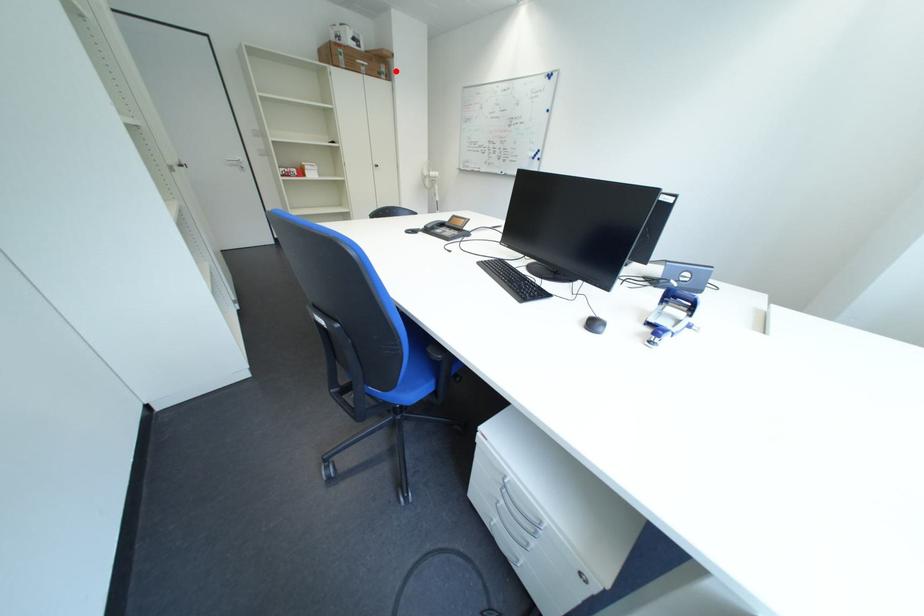
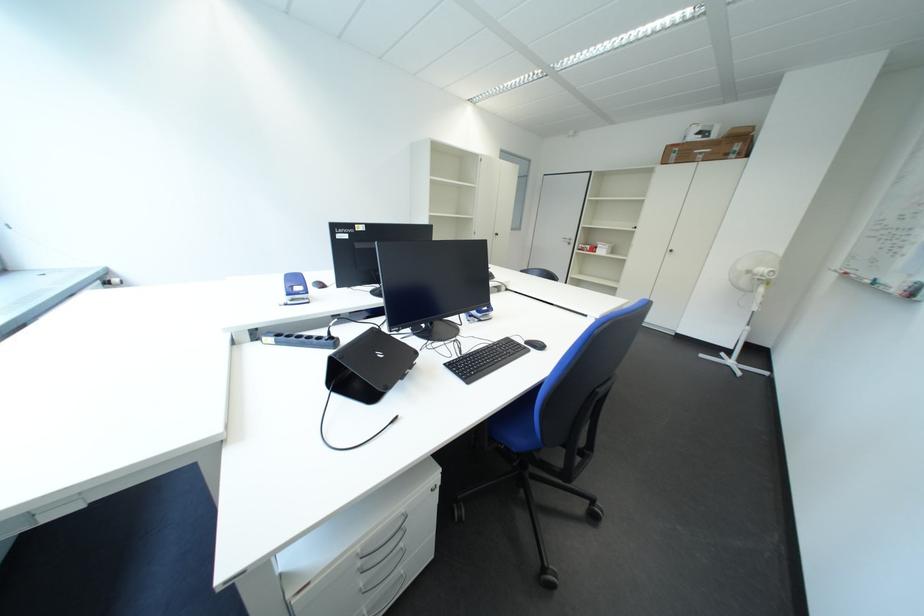
Locate, in the second image, the point that corresponds to the highlighted location in the first image.

(748, 150)